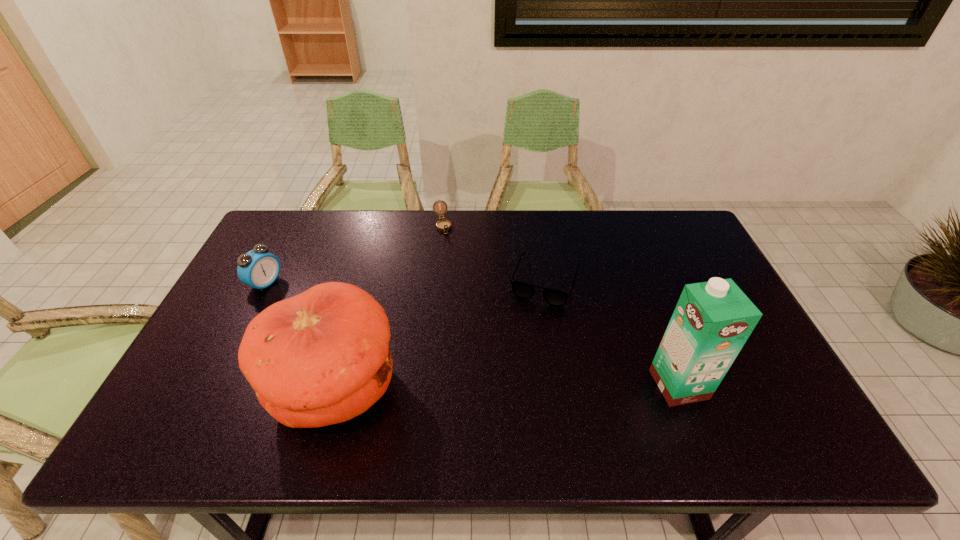
At what (x,y) coordinates should I click in order to perform the action: click on vacant space on the desktop that is between the pumpkin and the carton and is positioned on the face of the third object from right to left. Please return your answer as a coordinate pair (x, y). Image resolution: width=960 pixels, height=540 pixels. Looking at the image, I should click on (494, 387).

Where is `free space on the desktop that is between the pumpkin and the carton and is positioned on the front-facing side of the spectacles`? This screenshot has width=960, height=540. free space on the desktop that is between the pumpkin and the carton and is positioned on the front-facing side of the spectacles is located at coordinates (510, 387).

Image resolution: width=960 pixels, height=540 pixels. Identify the location of vacant spot on the desktop that is between the fourth object from right to left and the rightmost object and is positioned on the face of the alarm clock. point(480,387).